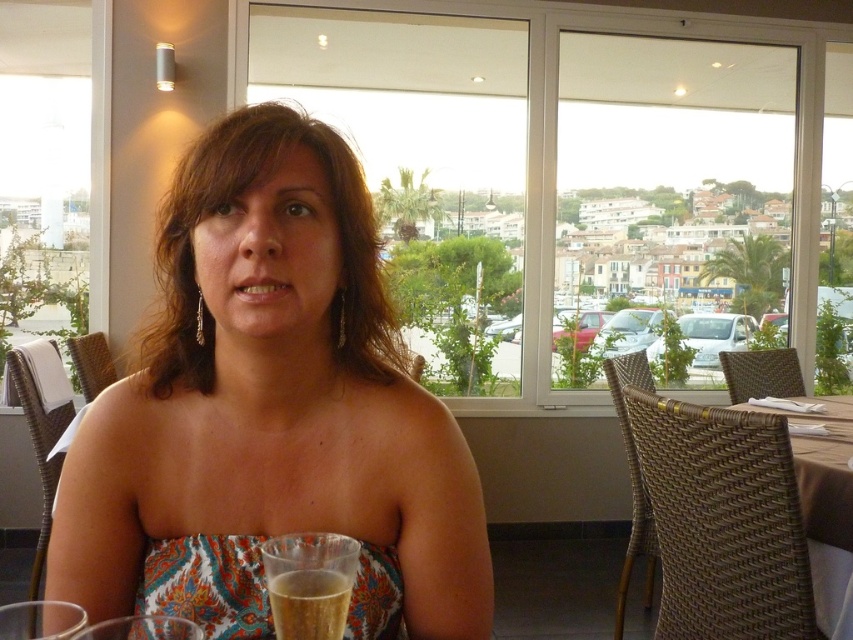
Question: Is transparent glass window at center smaller than printed fabric dress at lower center?

Choices:
 (A) yes
 (B) no

Answer: (B)

Question: Among these objects, which one is farthest from the camera?

Choices:
 (A) transparent glass window at center
 (B) multicolored fabric dress at center
 (C) translucent plastic cup at lower center

Answer: (A)

Question: Does transparent glass window at center have a lesser width compared to translucent plastic cup at lower center?

Choices:
 (A) no
 (B) yes

Answer: (A)

Question: Is multicolored fabric dress at center positioned behind brown woven table at right?

Choices:
 (A) yes
 (B) no

Answer: (B)

Question: Among these objects, which one is nearest to the camera?

Choices:
 (A) transparent glass window at center
 (B) brown woven table at right

Answer: (B)

Question: Considering the real-world distances, which object is farthest from the translucent plastic cup at lower center?

Choices:
 (A) brown woven table at right
 (B) multicolored fabric dress at center
 (C) printed fabric dress at lower center

Answer: (A)